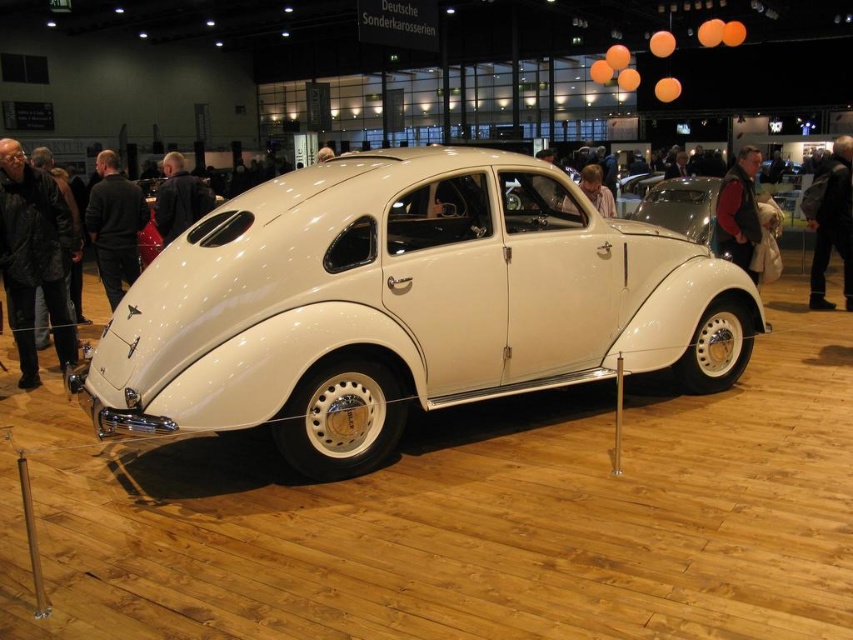
Question: Which point is closer to the camera?

Choices:
 (A) dark red leather jacket at center
 (B) black leather jacket at right

Answer: (A)

Question: From the image, what is the correct spatial relationship of dark red leather jacket at center in relation to dark blue leather jacket at center?

Choices:
 (A) above
 (B) below

Answer: (A)

Question: Considering the real-world distances, which object is farthest from the dark red leather jacket at center?

Choices:
 (A) dark blue leather jacket at center
 (B) black leather jacket at left

Answer: (B)

Question: Is dark blue leather jacket at center bigger than matte white car at center?

Choices:
 (A) no
 (B) yes

Answer: (A)

Question: Which object appears farthest from the camera in this image?

Choices:
 (A) black leather jacket at center
 (B) white matte car at center
 (C) black leather jacket at right
 (D) black leather jacket at left

Answer: (C)

Question: Does dark red leather jacket at center have a lesser width compared to matte white car at center?

Choices:
 (A) no
 (B) yes

Answer: (B)